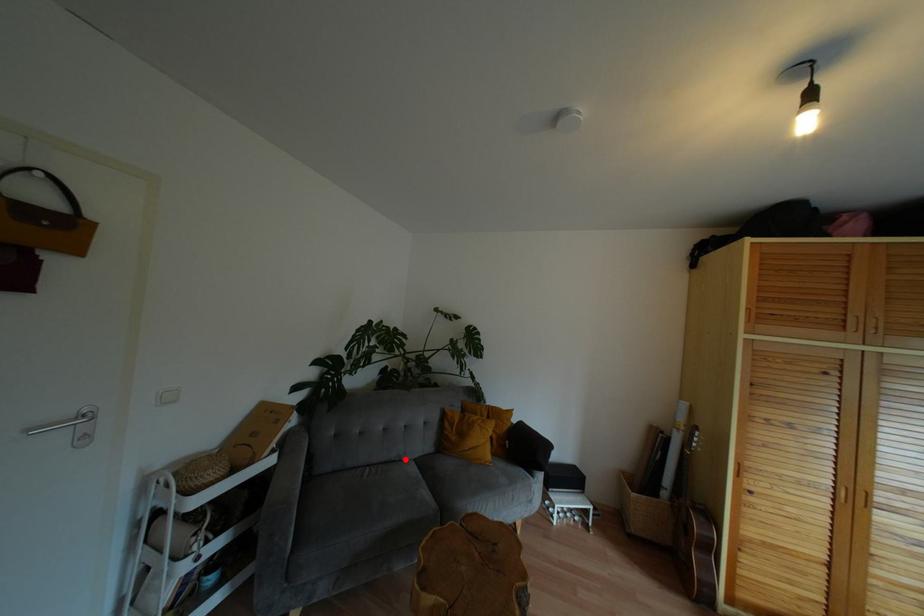
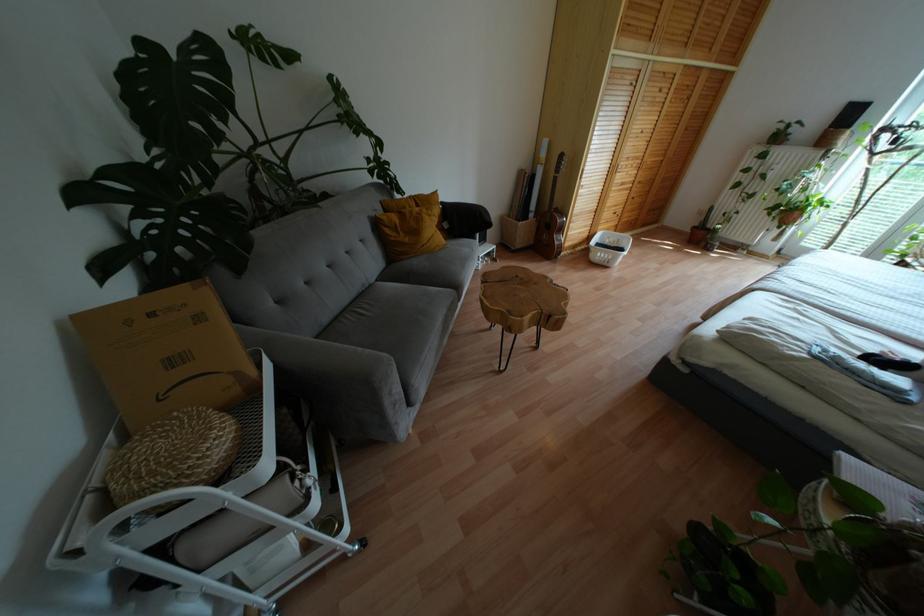
Question: I am providing you with two images of the same scene from different viewpoints. Image1 has a red point marked. In image2, the corresponding 3D location appears at what relative position? Reply with the corresponding letter.

Choices:
 (A) Closer
 (B) Farther

Answer: (A)